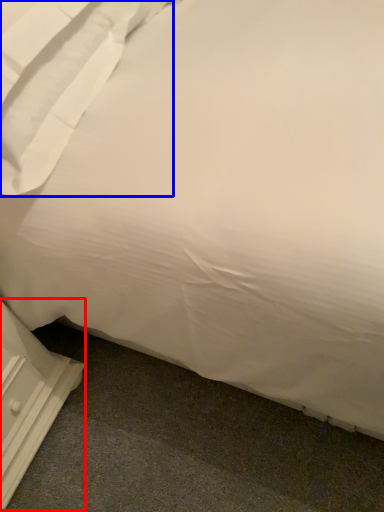
Question: Which of the following is the farthest to the observer, dresser (highlighted by a red box) or pillow (highlighted by a blue box)?

Choices:
 (A) dresser
 (B) pillow

Answer: (A)